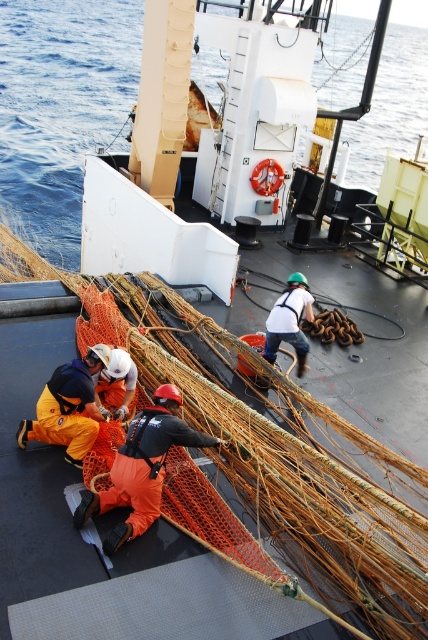
You are a crew member on the ship and need to secure the white fabric safety harness at center. Which direction should you move to reach it from the orange fabric worker at lower left?

The orange fabric worker at lower left is to the left of the white fabric safety harness at center, so you should move to the right to reach the white fabric safety harness at center.

You are a crew member on the ship and need to move from the blue water at upper left to the orange fabric worker at lower left. Which direction should you move to reach them?

To reach the orange fabric worker at lower left from the blue water at upper left, you should move to the right because the orange fabric worker at lower left is positioned on the right side of the blue water at upper left.